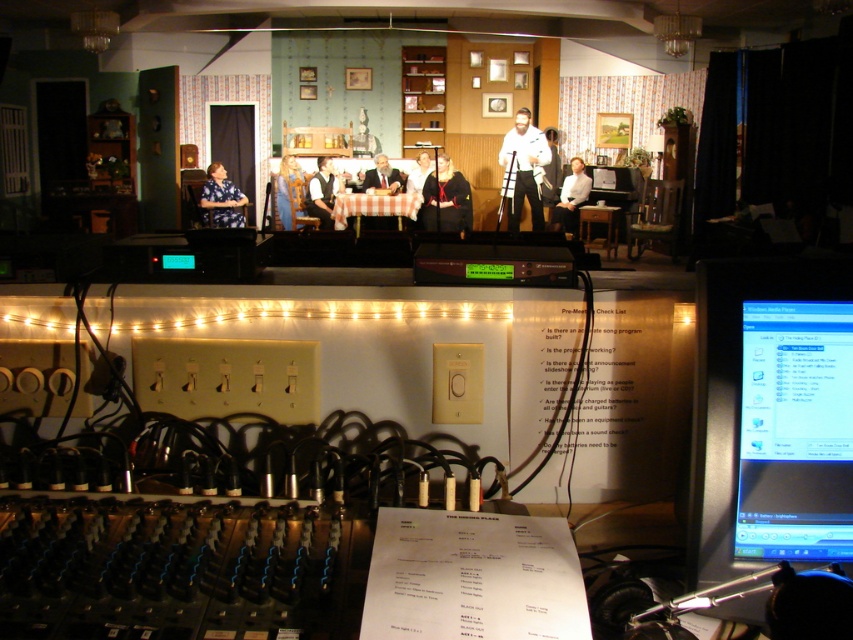
Question: Is matte black monitor at lower right to the left of wooden table at center from the viewer's perspective?

Choices:
 (A) no
 (B) yes

Answer: (B)

Question: Among these points, which one is farthest from the camera?

Choices:
 (A) (413, 172)
 (B) (393, 189)
 (C) (447, 204)
 (D) (817, 419)

Answer: (A)

Question: Observing the image, what is the correct spatial positioning of white matte chef hat at center in reference to matte blue dress at center?

Choices:
 (A) left
 (B) right

Answer: (B)

Question: Where is matte black monitor at lower right located in relation to matte black dress at center in the image?

Choices:
 (A) above
 (B) below

Answer: (B)

Question: Which object appears farthest from the camera in this image?

Choices:
 (A) smooth beige suit at center
 (B) matte blue dress at center
 (C) white shirt at center
 (D) checkered fabric table at center

Answer: (C)

Question: Among these points, which one is farthest from the camera?

Choices:
 (A) (517, 205)
 (B) (460, 209)

Answer: (A)